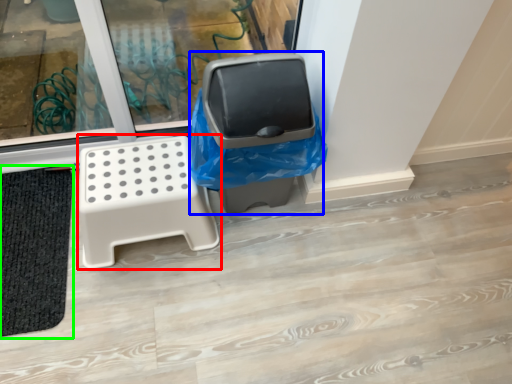
Question: Considering the real-world distances, which object is farthest from furniture (highlighted by a red box)? garbage (highlighted by a blue box) or bath mat (highlighted by a green box)?

Choices:
 (A) garbage
 (B) bath mat

Answer: (B)